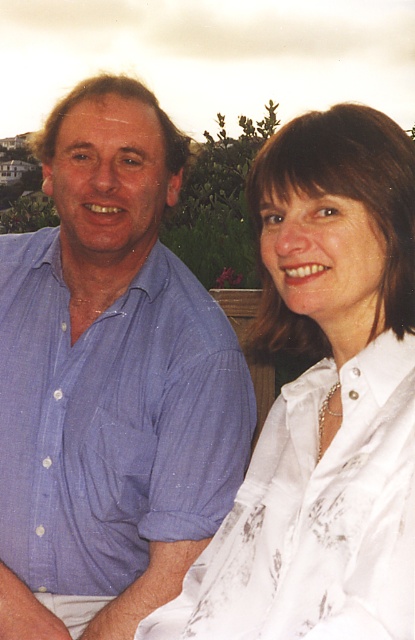
Question: Does blue cotton shirt at left have a greater width compared to white satin blouse at upper right?

Choices:
 (A) yes
 (B) no

Answer: (B)

Question: Which of the following is the farthest from the observer?

Choices:
 (A) (270, 228)
 (B) (87, 396)

Answer: (A)

Question: Which object appears closest to the camera in this image?

Choices:
 (A) blue cotton shirt at left
 (B) white satin blouse at upper right

Answer: (B)

Question: Which point is closer to the camera?

Choices:
 (A) blue cotton shirt at left
 (B) white satin blouse at upper right

Answer: (B)

Question: Is blue cotton shirt at left wider than white satin blouse at upper right?

Choices:
 (A) no
 (B) yes

Answer: (A)

Question: Does blue cotton shirt at left have a lesser width compared to white satin blouse at upper right?

Choices:
 (A) no
 (B) yes

Answer: (B)